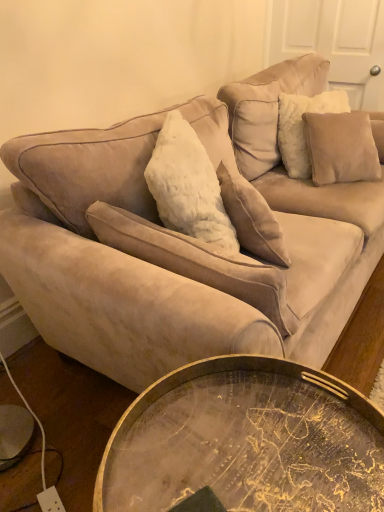
Question: From their relative heights in the image, would you say suede beige pillow at upper right, placed as the 1th pillow when sorted from right to left, is taller or shorter than white fluffy pillow at center, acting as the 1th pillow starting from the left?

Choices:
 (A) tall
 (B) short

Answer: (B)

Question: Based on their sizes in the image, would you say suede beige pillow at upper right, which appears as the 3th pillow when viewed from the front, is bigger or smaller than white fluffy pillow at center, the third pillow viewed from the back?

Choices:
 (A) big
 (B) small

Answer: (A)

Question: Considering the real-world distances, which object is closest to the white fluffy pillow at center, which is counted as the 3th pillow, starting from the right?

Choices:
 (A) suede beige couch at upper center
 (B) suede beige pillow at upper right, which is the first pillow from back to front
 (C) suede beige pillow at upper right, arranged as the second pillow when viewed from the back
 (D) gold metallic tray at lower center

Answer: (A)

Question: Estimate the real-world distances between objects in this image. Which object is closer to the suede beige pillow at upper right, placed as the 1th pillow when sorted from right to left?

Choices:
 (A) white fluffy pillow at center, the third pillow viewed from the back
 (B) suede beige couch at upper center
 (C) gold metallic tray at lower center
 (D) suede beige pillow at upper right, the second pillow viewed from the front

Answer: (D)